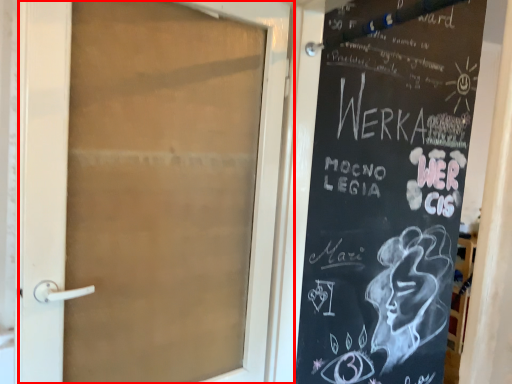
Question: From the image's perspective, what is the correct spatial positioning of door (annotated by the red box) in reference to bulletin board?

Choices:
 (A) below
 (B) above

Answer: (B)